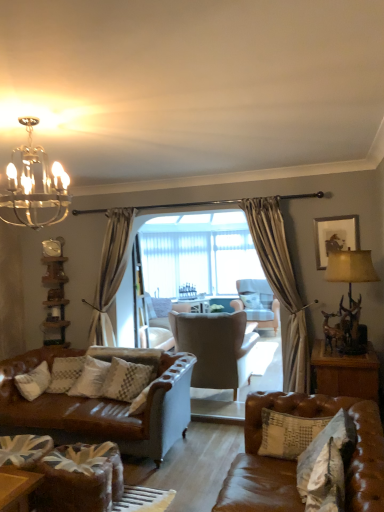
What do you see at coordinates (345, 372) in the screenshot? I see `brown leather table at lower right` at bounding box center [345, 372].

This screenshot has height=512, width=384. What do you see at coordinates (139, 298) in the screenshot?
I see `clear glass screen door at center` at bounding box center [139, 298].

Measure the distance between light brown fabric chair at center, which ranks as the second chair in front-to-back order, and camera.

light brown fabric chair at center, which ranks as the second chair in front-to-back order, and camera are 5.53 meters apart from each other.

The width and height of the screenshot is (384, 512). Describe the element at coordinates (126, 380) in the screenshot. I see `white textured pillow at center, acting as the fourth pillow starting from the right` at that location.

Identify the location of gold metallic chandelier at upper left. This screenshot has width=384, height=512. (34, 184).

The image size is (384, 512). I want to click on suede wingback chair at center, placed as the 1th chair when sorted from front to back, so click(x=215, y=348).

Image resolution: width=384 pixels, height=512 pixels. What are the coordinates of `brown leather table at lower right` in the screenshot? It's located at (345, 372).

Find the location of `light fixture that is above the light brown fabric chair at center, which ranks as the second chair in front-to-back order (from a real-world perspective)`. light fixture that is above the light brown fabric chair at center, which ranks as the second chair in front-to-back order (from a real-world perspective) is located at coordinates (34, 184).

Can you confirm if gold metallic chandelier at upper left is taller than light brown fabric chair at center, marked as the second chair in a left-to-right arrangement?

No, gold metallic chandelier at upper left is not taller than light brown fabric chair at center, marked as the second chair in a left-to-right arrangement.

Are gold metallic chandelier at upper left and light brown fabric chair at center, which appears as the first chair when viewed from the back, making contact?

No, gold metallic chandelier at upper left is not with light brown fabric chair at center, which appears as the first chair when viewed from the back.

Which object is more forward, gold metallic chandelier at upper left or light brown fabric chair at center, which appears as the first chair when viewed from the back?

Positioned in front is gold metallic chandelier at upper left.

What's the angular difference between brown leather table at lower right and light brown fabric chair at center, arranged as the first chair when viewed from the right,'s facing directions?

They differ by 99 degrees in their facing directions.

From a real-world perspective, between brown leather table at lower right and light brown fabric chair at center, arranged as the first chair when viewed from the right, who is vertically lower?

From a 3D spatial view, brown leather table at lower right is below.

Considering the sizes of objects brown leather table at lower right and light brown fabric chair at center, which appears as the first chair when viewed from the back, in the image provided, who is taller, brown leather table at lower right or light brown fabric chair at center, which appears as the first chair when viewed from the back,?

light brown fabric chair at center, which appears as the first chair when viewed from the back, is taller.

Can you confirm if brown leather table at lower right is positioned to the left of light brown fabric chair at center, which ranks as the second chair in front-to-back order?

In fact, brown leather table at lower right is to the right of light brown fabric chair at center, which ranks as the second chair in front-to-back order.

Does wooden framed picture at upper right have a greater width compared to white textured pillow at center, arranged as the 3th pillow when viewed from the front?

In fact, wooden framed picture at upper right might be narrower than white textured pillow at center, arranged as the 3th pillow when viewed from the front.

Is wooden framed picture at upper right positioned with its back to white textured pillow at center, the second pillow when ordered from back to front?

wooden framed picture at upper right is not turned away from white textured pillow at center, the second pillow when ordered from back to front.

Considering the relative sizes of wooden framed picture at upper right and white textured pillow at center, acting as the fourth pillow starting from the right, in the image provided, is wooden framed picture at upper right smaller than white textured pillow at center, acting as the fourth pillow starting from the right,?

Yes, wooden framed picture at upper right is smaller than white textured pillow at center, acting as the fourth pillow starting from the right.

From a real-world perspective, is wooden framed picture at upper right positioned above or below white textured pillow at center, the second pillow when ordered from back to front?

From a real-world perspective, wooden framed picture at upper right is physically above white textured pillow at center, the second pillow when ordered from back to front.

From a real-world perspective, is white textured pillow at lower right, arranged as the first pillow when viewed from the front, positioned above or below white textured pillow at lower right, which is counted as the 2th pillow, starting from the front?

From a real-world perspective, white textured pillow at lower right, arranged as the first pillow when viewed from the front, is physically above white textured pillow at lower right, which is counted as the 2th pillow, starting from the front.

Who is bigger, white textured pillow at lower right, the 4th pillow positioned from the back, or white textured pillow at lower right, which is counted as the 2th pillow, starting from the front?

Bigger between the two is white textured pillow at lower right, which is counted as the 2th pillow, starting from the front.

Could white textured pillow at lower right, the third pillow positioned from the back, be considered to be inside white textured pillow at lower right, the 4th pillow positioned from the back?

Actually, white textured pillow at lower right, the third pillow positioned from the back, is outside white textured pillow at lower right, the 4th pillow positioned from the back.

Is white textured pillow at lower right, arranged as the first pillow when viewed from the front, touching white textured pillow at lower right, acting as the second pillow starting from the right?

There is a gap between white textured pillow at lower right, arranged as the first pillow when viewed from the front, and white textured pillow at lower right, acting as the second pillow starting from the right.

Based on the photo, which is correct: white textured pillow at center, marked as the first pillow in a right-to-left arrangement, is inside white textured pillow at lower right, acting as the second pillow starting from the right, or outside of it?

white textured pillow at center, marked as the first pillow in a right-to-left arrangement, is located beyond the bounds of white textured pillow at lower right, acting as the second pillow starting from the right.

Between white textured pillow at center, the fourth pillow in the front-to-back sequence, and white textured pillow at lower right, acting as the second pillow starting from the right, which one has smaller width?

white textured pillow at lower right, acting as the second pillow starting from the right.

Is white textured pillow at center, the fourth pillow in the front-to-back sequence, smaller than white textured pillow at lower right, arranged as the 3th pillow when viewed from the left?

Incorrect, white textured pillow at center, the fourth pillow in the front-to-back sequence, is not smaller in size than white textured pillow at lower right, arranged as the 3th pillow when viewed from the left.

Could you tell me if white textured pillow at center, marked as the first pillow in a right-to-left arrangement, is facing white textured pillow at lower right, the third pillow positioned from the back?

Yes, white textured pillow at center, marked as the first pillow in a right-to-left arrangement, is aimed at white textured pillow at lower right, the third pillow positioned from the back.

From a real-world perspective, is brown leather table at lower right physically located above or below white textured pillow at center, which is the fourth pillow in left-to-right order?

brown leather table at lower right is below white textured pillow at center, which is the fourth pillow in left-to-right order.

Looking at this image, from the image's perspective, which object appears higher, brown leather table at lower right or white textured pillow at center, the fourth pillow in the front-to-back sequence?

From the image's view, white textured pillow at center, the fourth pillow in the front-to-back sequence, is above.

Considering the relative sizes of brown leather table at lower right and white textured pillow at center, marked as the first pillow in a right-to-left arrangement, in the image provided, is brown leather table at lower right smaller than white textured pillow at center, marked as the first pillow in a right-to-left arrangement,?

No.

Would you say brown leather table at lower right is outside white textured pillow at center, which is the first pillow in back-to-front order?

That's correct, brown leather table at lower right is outside of white textured pillow at center, which is the first pillow in back-to-front order.

Is white textured pillow at center, acting as the fourth pillow starting from the right, oriented towards light brown fabric chair at center, which ranks as the second chair in front-to-back order?

No, white textured pillow at center, acting as the fourth pillow starting from the right, is not oriented towards light brown fabric chair at center, which ranks as the second chair in front-to-back order.

You are a GUI agent. You are given a task and a screenshot of the screen. Output one action in this format:
    pyautogui.click(x=<x>, y=<y>)
    Task: Click on the pillow that is the 4th object located below the light brown fabric chair at center, arranged as the first chair when viewed from the right (from the image's perspective)
    Image resolution: width=384 pixels, height=512 pixels.
    Given the screenshot: What is the action you would take?
    pyautogui.click(x=126, y=380)

Is white textured pillow at center, arranged as the 3th pillow when viewed from the front, closer to the viewer compared to light brown fabric chair at center, which ranks as the second chair in front-to-back order?

Yes, it is.

From the image's perspective, between white textured pillow at center, the second pillow when ordered from back to front, and light brown fabric chair at center, which ranks as the second chair in front-to-back order, which one is located above?

light brown fabric chair at center, which ranks as the second chair in front-to-back order, from the image's perspective.

The image size is (384, 512). There is a gold metallic chandelier at upper left. What are the coordinates of `the 1st chair below it (from the image's perspective)` in the screenshot? It's located at (258, 303).

Where is `table that appears below the light brown fabric chair at center, which appears as the first chair when viewed from the back (from a real-world perspective)`? table that appears below the light brown fabric chair at center, which appears as the first chair when viewed from the back (from a real-world perspective) is located at coordinates (345, 372).

Based on their spatial positions, is suede wingback chair at center, the 2th chair when ordered from right to left, or white textured pillow at center, which is the 1th pillow in left-to-right order, closer to brown leather couch at lower right?

Among the two, white textured pillow at center, which is the 1th pillow in left-to-right order, is located nearer to brown leather couch at lower right.

Estimate the real-world distances between objects in this image. Which object is closer to gold metallic chandelier at upper left, white textured pillow at lower right, which is counted as the 2th pillow, starting from the front, or white textured pillow at center, marked as the first pillow in a right-to-left arrangement?

white textured pillow at lower right, which is counted as the 2th pillow, starting from the front, is closer to gold metallic chandelier at upper left.

Which object lies further to the anchor point white textured pillow at lower right, which is counted as the 2th pillow, starting from the front, suede wingback chair at center, the 2th chair when ordered from right to left, or brown leather couch at lower right?

Based on the image, suede wingback chair at center, the 2th chair when ordered from right to left, appears to be further to white textured pillow at lower right, which is counted as the 2th pillow, starting from the front.

From the image, which object appears to be farther from white textured pillow at lower right, the second pillow in the left-to-right sequence, white textured pillow at center, arranged as the 3th pillow when viewed from the front, or wooden framed picture at upper right?

Among the two, wooden framed picture at upper right is located further to white textured pillow at lower right, the second pillow in the left-to-right sequence.

When comparing their distances from brown leather couch at lower right, does suede wingback chair at center, placed as the first chair when sorted from left to right, or white textured pillow at lower right, acting as the second pillow starting from the right, seem further?

suede wingback chair at center, placed as the first chair when sorted from left to right, is positioned further to the anchor brown leather couch at lower right.

Estimate the real-world distances between objects in this image. Which object is closer to light brown fabric chair at center, which appears as the first chair when viewed from the back, white textured pillow at center, the fourth pillow in the front-to-back sequence, or white textured pillow at center, which is the 1th pillow in left-to-right order?

Among the two, white textured pillow at center, the fourth pillow in the front-to-back sequence, is located nearer to light brown fabric chair at center, which appears as the first chair when viewed from the back.

Estimate the real-world distances between objects in this image. Which object is further from white textured pillow at lower right, arranged as the 3th pillow when viewed from the left, white textured pillow at lower right, positioned as the third pillow in right-to-left order, or clear glass screen door at center?

clear glass screen door at center is positioned further to the anchor white textured pillow at lower right, arranged as the 3th pillow when viewed from the left.

Based on their spatial positions, is gold metallic chandelier at upper left or brown leather couch at lower right closer to white textured pillow at center, arranged as the 3th pillow when viewed from the front?

The object closer to white textured pillow at center, arranged as the 3th pillow when viewed from the front, is brown leather couch at lower right.

Find the location of `table located between white textured pillow at lower right, arranged as the first pillow when viewed from the front, and suede wingback chair at center, placed as the first chair when sorted from left to right, in the depth direction`. table located between white textured pillow at lower right, arranged as the first pillow when viewed from the front, and suede wingback chair at center, placed as the first chair when sorted from left to right, in the depth direction is located at coordinates (345, 372).

Find the location of a particular element. The height and width of the screenshot is (512, 384). light fixture located between white textured pillow at lower right, the 4th pillow positioned from the back, and clear glass screen door at center in the depth direction is located at coordinates (34, 184).

Locate an element on the screen. The height and width of the screenshot is (512, 384). table positioned between brown leather couch at lower right and suede wingback chair at center, placed as the first chair when sorted from left to right, from near to far is located at coordinates (x=345, y=372).

Identify the location of light fixture between brown leather couch at lower right and clear glass screen door at center from front to back. This screenshot has height=512, width=384. (34, 184).